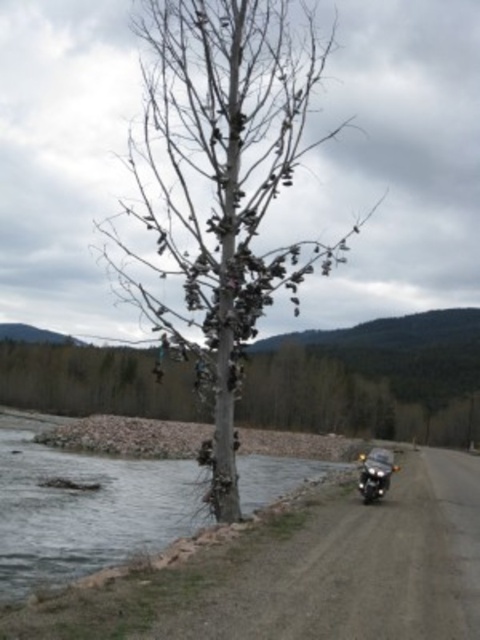
Which of these two, shiny metallic shoes at center or shiny black motorcycle at right, stands shorter?

With less height is shiny black motorcycle at right.

Who is taller, shiny metallic shoes at center or shiny black motorcycle at right?

shiny metallic shoes at center is taller.

Find the location of a particular element. shiny metallic shoes at center is located at coordinates (220, 186).

The width and height of the screenshot is (480, 640). I want to click on shiny metallic shoes at center, so click(x=220, y=186).

Is clear water at lower left shorter than shiny black motorcycle at right?

Indeed, clear water at lower left has a lesser height compared to shiny black motorcycle at right.

Can you confirm if clear water at lower left is taller than shiny black motorcycle at right?

No.

What do you see at coordinates (179, 580) in the screenshot?
I see `clear water at lower left` at bounding box center [179, 580].

Where is `clear water at lower left`? This screenshot has width=480, height=640. clear water at lower left is located at coordinates (179, 580).

Between shiny metallic shoes at center and clear water at lower left, which one is positioned lower?

Positioned lower is clear water at lower left.

Between shiny metallic shoes at center and clear water at lower left, which one appears on the left side from the viewer's perspective?

clear water at lower left is more to the left.

Is point (154, 154) positioned before point (16, 618)?

No, it is behind (16, 618).

The width and height of the screenshot is (480, 640). I want to click on shiny metallic shoes at center, so click(x=220, y=186).